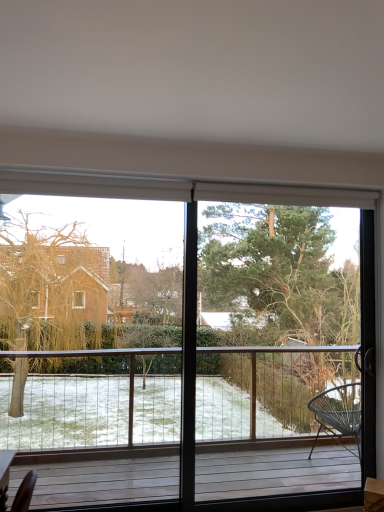
Question: Is green textured tree at center situated inside transparent glass window at center or outside?

Choices:
 (A) outside
 (B) inside

Answer: (B)

Question: Looking at their shapes, would you say green textured tree at center is wider or thinner than transparent glass window at center?

Choices:
 (A) thin
 (B) wide

Answer: (B)

Question: Considering the positions of point (231, 398) and point (375, 295), is point (231, 398) closer or farther from the camera than point (375, 295)?

Choices:
 (A) farther
 (B) closer

Answer: (A)

Question: From the image's perspective, relative to green textured tree at center, is transparent glass window at center above or below?

Choices:
 (A) below
 (B) above

Answer: (A)

Question: From a real-world perspective, is transparent glass window at center positioned above or below green textured tree at center?

Choices:
 (A) below
 (B) above

Answer: (A)

Question: Visually, is transparent glass window at center positioned to the left or to the right of green textured tree at center?

Choices:
 (A) right
 (B) left

Answer: (B)

Question: Does point (173, 190) appear closer or farther from the camera than point (309, 293)?

Choices:
 (A) closer
 (B) farther

Answer: (A)